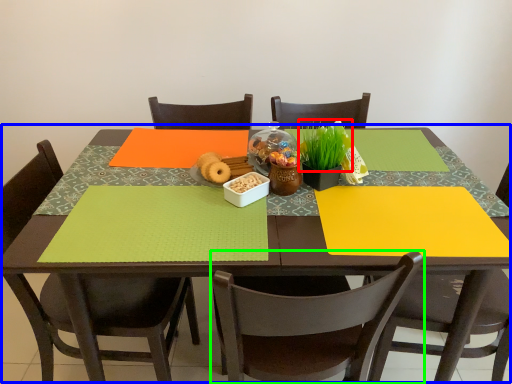
Question: Estimate the real-world distances between objects in this image. Which object is closer to plant (highlighted by a red box), table (highlighted by a blue box) or chair (highlighted by a green box)?

Choices:
 (A) table
 (B) chair

Answer: (A)